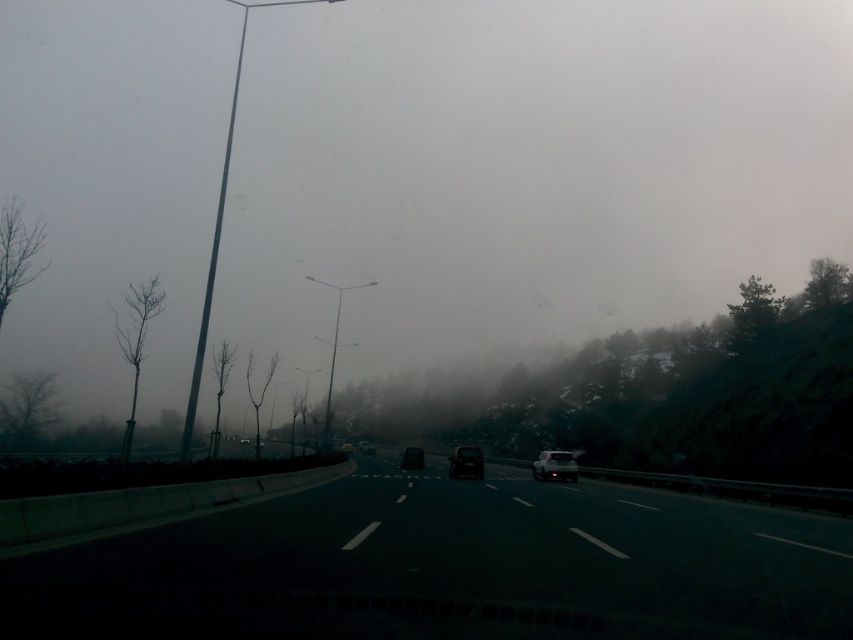
Which is above, satin white sedan at center or black matte car at center?

satin white sedan at center is higher up.

Does satin white sedan at center have a larger size compared to black matte car at center?

Actually, satin white sedan at center might be smaller than black matte car at center.

The image size is (853, 640). Describe the element at coordinates (555, 465) in the screenshot. I see `satin white sedan at center` at that location.

You are a GUI agent. You are given a task and a screenshot of the screen. Output one action in this format:
    pyautogui.click(x=<x>, y=<y>)
    Task: Click on the satin white sedan at center
    
    Given the screenshot: What is the action you would take?
    pyautogui.click(x=555, y=465)

Looking at this image, can you confirm if black asphalt highway at center is taller than black glossy car at center?

Incorrect, black asphalt highway at center's height is not larger of black glossy car at center's.

Does black asphalt highway at center appear under black glossy car at center?

Incorrect, black asphalt highway at center is not positioned below black glossy car at center.

I want to click on black asphalt highway at center, so click(x=450, y=566).

Find the location of `black asphalt highway at center`. black asphalt highway at center is located at coordinates (450, 566).

Is satin white sedan at center shorter than black glossy car at center?

Yes.

Can you confirm if satin white sedan at center is smaller than black glossy car at center?

Indeed, satin white sedan at center has a smaller size compared to black glossy car at center.

Where is `satin white sedan at center`? satin white sedan at center is located at coordinates (555, 465).